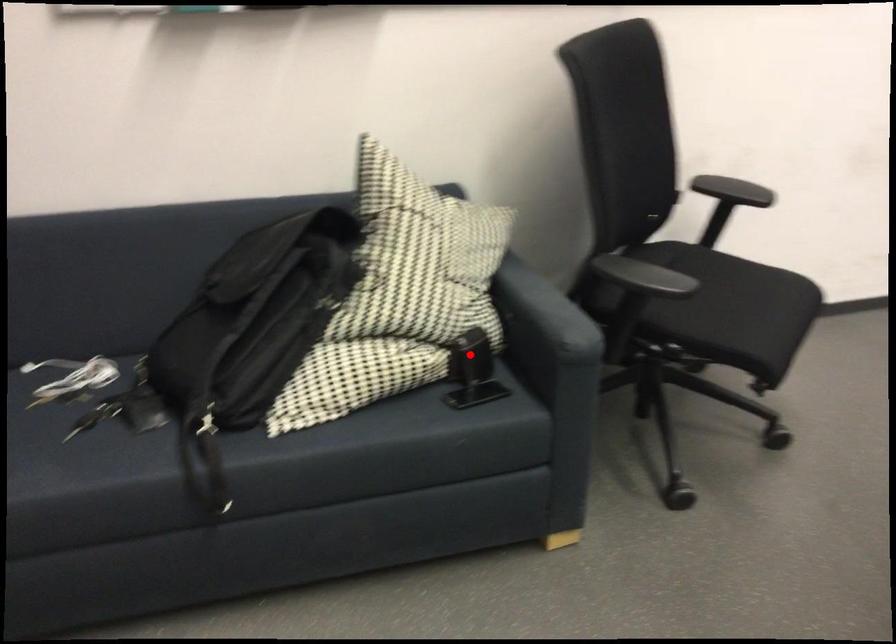
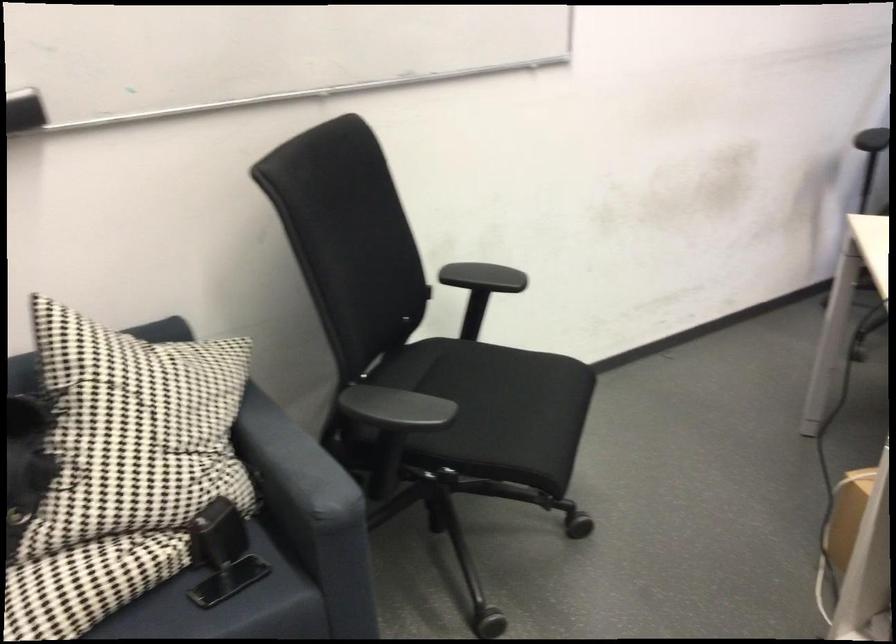
In the second image, find the point that corresponds to the highlighted location in the first image.

(218, 534)